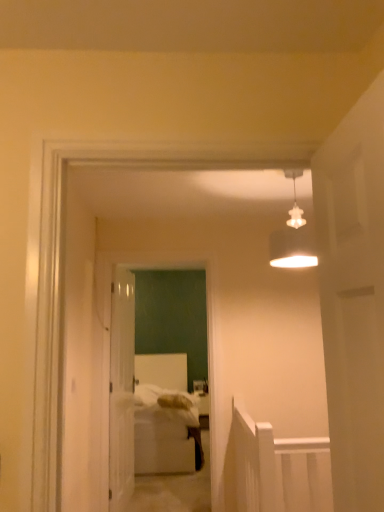
Question: Is white glossy door at center completely or partially inside white matte lampshade at upper center?

Choices:
 (A) no
 (B) yes

Answer: (A)

Question: Could you tell me if white matte lampshade at upper center is turned towards white glossy door at center?

Choices:
 (A) no
 (B) yes

Answer: (A)

Question: From a real-world perspective, is white matte lampshade at upper center under white glossy door at center?

Choices:
 (A) no
 (B) yes

Answer: (A)

Question: Considering the relative positions of white matte lampshade at upper center and white glossy door at center in the image provided, is white matte lampshade at upper center behind white glossy door at center?

Choices:
 (A) yes
 (B) no

Answer: (B)

Question: Does white matte lampshade at upper center have a greater height compared to white glossy door at center?

Choices:
 (A) no
 (B) yes

Answer: (A)

Question: Is white matte lampshade at upper center closer to camera compared to white glossy door at center?

Choices:
 (A) yes
 (B) no

Answer: (A)

Question: From a real-world perspective, is white matte door at right, which is counted as the 2th door, starting from the back, positioned over white glossy door at center based on gravity?

Choices:
 (A) yes
 (B) no

Answer: (A)

Question: Is white matte door at right, arranged as the first door when viewed from the right, facing away from white glossy door at center?

Choices:
 (A) yes
 (B) no

Answer: (B)

Question: Can you confirm if white matte door at right, acting as the second door starting from the left, is positioned to the left of white glossy door at center?

Choices:
 (A) yes
 (B) no

Answer: (B)

Question: Would you consider white matte door at right, acting as the second door starting from the left, to be distant from white glossy door at center?

Choices:
 (A) no
 (B) yes

Answer: (B)

Question: Is white matte door at right, which is counted as the 2th door, starting from the back, taller than white glossy door at center?

Choices:
 (A) no
 (B) yes

Answer: (A)

Question: Is white matte door at right, which is counted as the 2th door, starting from the back, in front of white glossy door at center?

Choices:
 (A) no
 (B) yes

Answer: (B)

Question: Is white glossy door at center completely or partially outside of white matte lampshade at upper center?

Choices:
 (A) no
 (B) yes

Answer: (B)